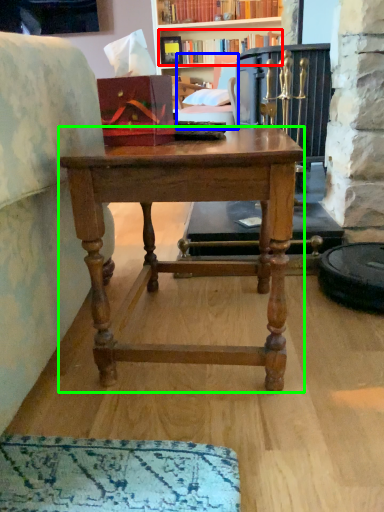
Question: Estimate the real-world distances between objects in this image. Which object is closer to book (highlighted by a red box), swivel chair (highlighted by a blue box) or desk (highlighted by a green box)?

Choices:
 (A) swivel chair
 (B) desk

Answer: (A)